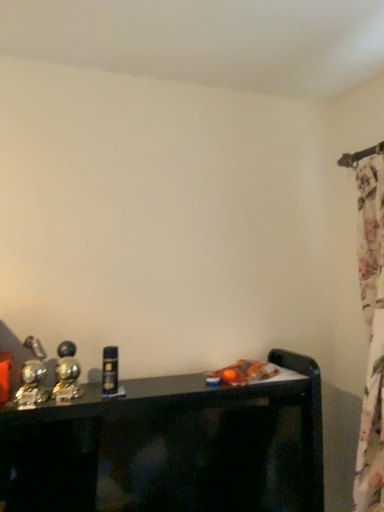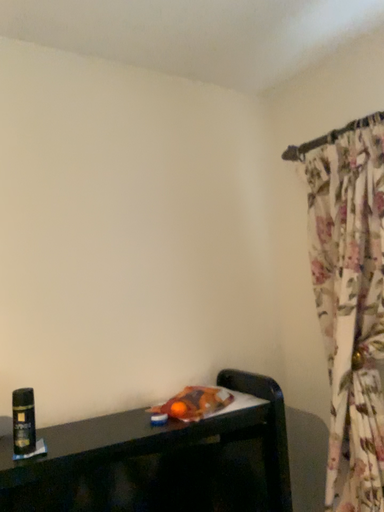
Question: How did the camera likely rotate when shooting the video?

Choices:
 (A) rotated right
 (B) rotated left

Answer: (A)